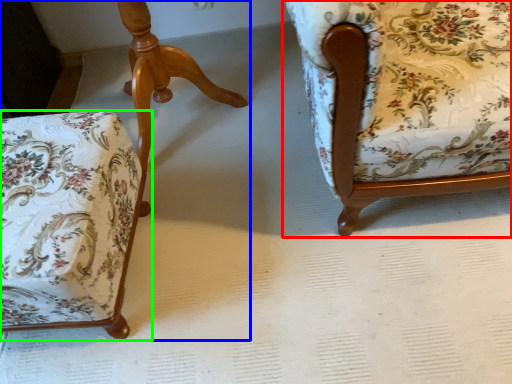
Question: Based on their relative distances, which object is nearer to chair (highlighted by a red box)? Choose from chair (highlighted by a blue box) and chair (highlighted by a green box).

Choices:
 (A) chair
 (B) chair

Answer: (B)